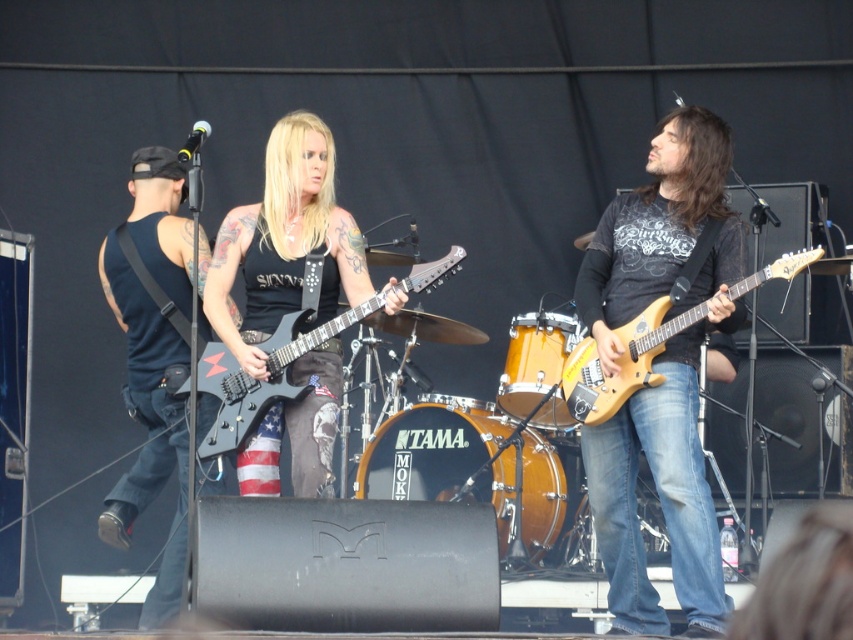
In the scene shown: You are a photographer at the concert. You need to capture a photo where both the matte black guitar at center and the black matte tank top at left are visible. Based on their positions, will the guitar block the view of the tank top?

The matte black guitar at center is above the black matte tank top at left, so the guitar will not block the view of the tank top since it is positioned higher up.

You are a photographer at the concert and want to take a photo of the guitarist wearing the black matte tank top at left and the matte black guitar at center. Based on their positions, which one should you focus on first to ensure both are in frame?

The matte black guitar at center is positioned on the right side of black matte tank top at left, so you should focus on the black matte tank top at left first to ensure both are in frame.

Looking at this image, you are standing at the camera position and want to throw a water balloon to the black matte tank top at left. Is the distance feasible for an average adult to throw a water balloon that far?

The distance between the black matte tank top at left and the camera is 13.44 meters. An average adult can throw a water balloon approximately 15 meters, so it is feasible but requires a strong throw.